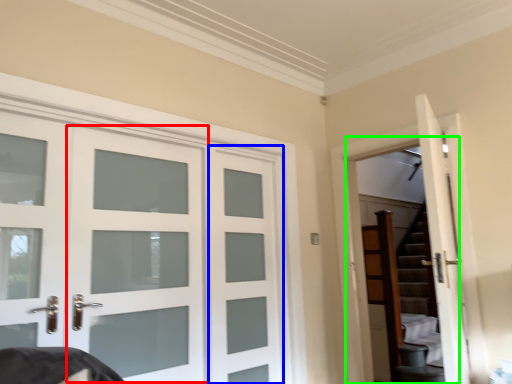
Question: Based on their relative distances, which object is nearer to screen door (highlighted by a red box)? Choose from screen door (highlighted by a blue box) and garage door (highlighted by a green box).

Choices:
 (A) screen door
 (B) garage door

Answer: (A)